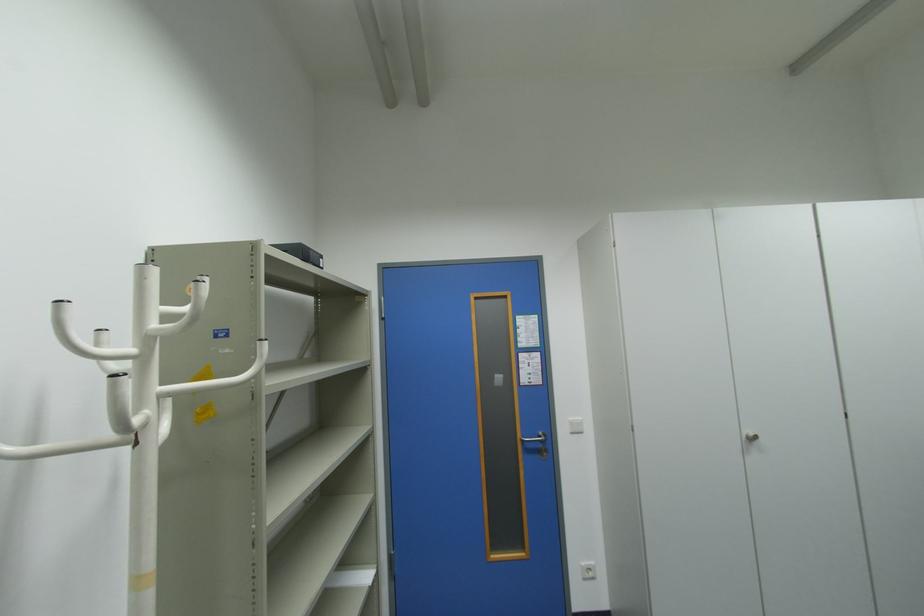
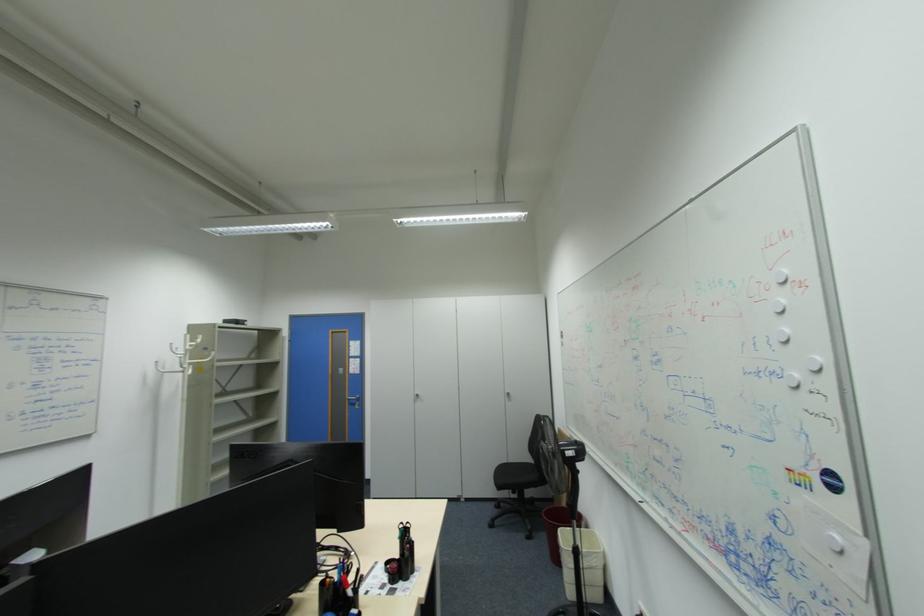
What movement of the cameraman would produce the second image?

The cameraman walked toward right, backward.